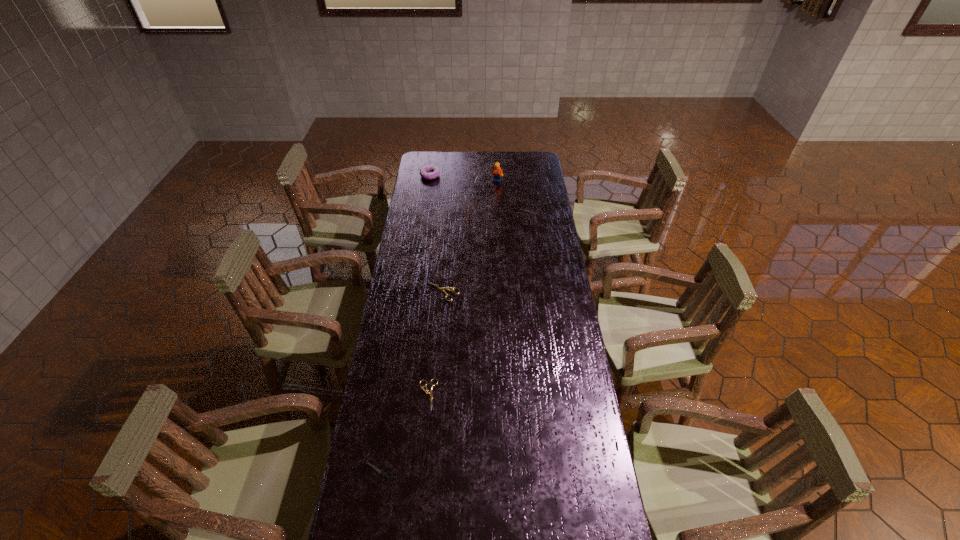
Where is `vacant area between the third nearest object and the rightmost shears`? The width and height of the screenshot is (960, 540). vacant area between the third nearest object and the rightmost shears is located at coordinates (485, 251).

The width and height of the screenshot is (960, 540). Identify the location of free spot between the bigger beige shears and the second object from right to left. (470, 236).

Identify the location of vacant space that is in between the farther beige shears and the sunglasses. This screenshot has width=960, height=540. point(450,253).

Point out which object is positioned as the second nearest to the nearer beige shears. Please provide its 2D coordinates. Your answer should be formatted as a tuple, i.e. [(x, y)], where the tuple contains the x and y coordinates of a point satisfying the conditions above.

[(445, 288)]

Find the location of `object that ranks as the second closest to the nearer black shears`. object that ranks as the second closest to the nearer black shears is located at coordinates (445, 288).

The height and width of the screenshot is (540, 960). In order to click on shears identified as the closest to the leftmost shears in this screenshot , I will do `click(426, 391)`.

Find the location of a particular element. The height and width of the screenshot is (540, 960). the closest shears to the tallest object is located at coordinates (521, 208).

Select which beige shears is the second closest to the second object from right to left. Please provide its 2D coordinates. Your answer should be formatted as a tuple, i.e. [(x, y)], where the tuple contains the x and y coordinates of a point satisfying the conditions above.

[(426, 391)]

The height and width of the screenshot is (540, 960). In order to click on free spot that satisfies the following two spatial constraints: 1. on the front side of the doughnut; 2. on the right side of the third farthest shears in this screenshot , I will do `click(397, 395)`.

This screenshot has width=960, height=540. Find the location of `free space that satisfies the following two spatial constraints: 1. on the front-facing side of the orange Lego; 2. on the face of the sunglasses`. free space that satisfies the following two spatial constraints: 1. on the front-facing side of the orange Lego; 2. on the face of the sunglasses is located at coordinates (498, 214).